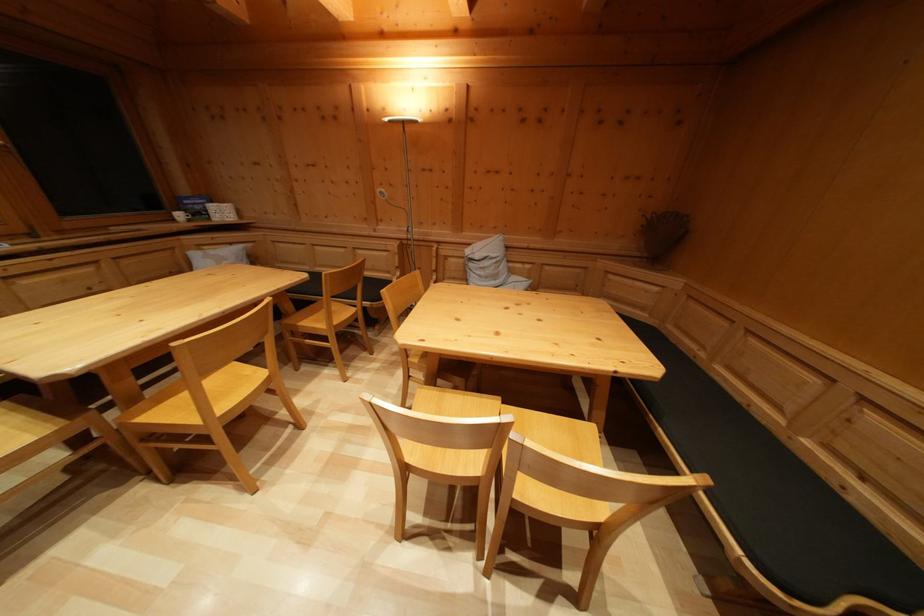
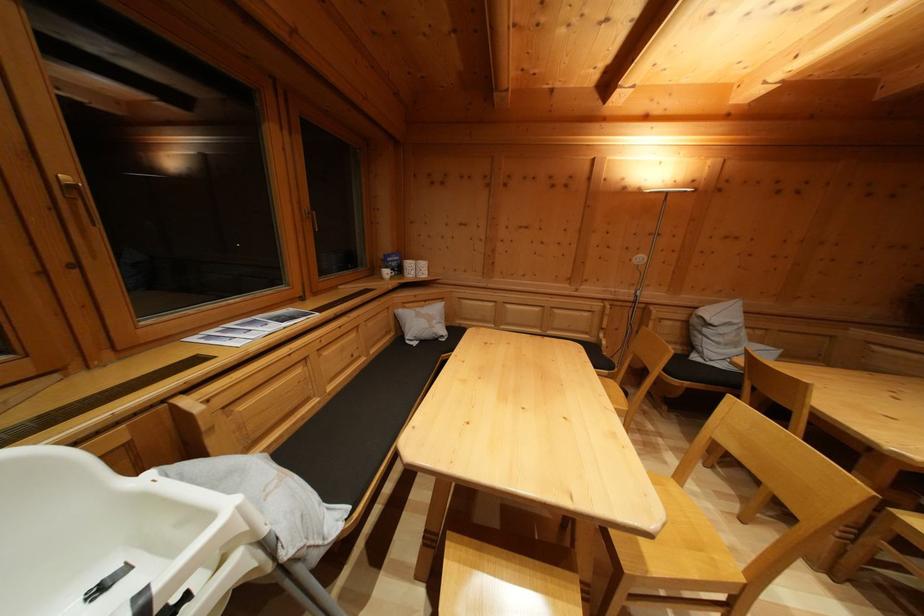
In the second image, find the point that corresponds to point (237, 251) in the first image.

(431, 308)